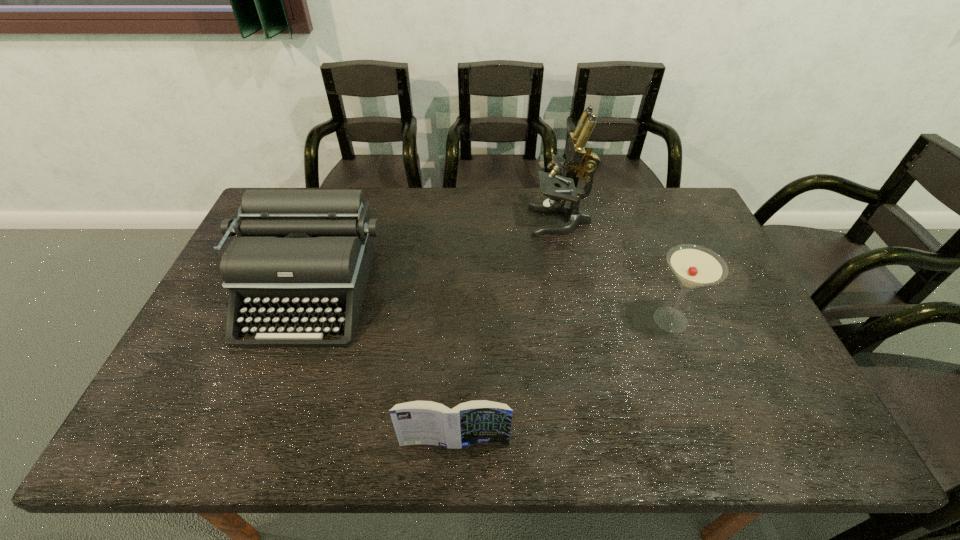
Locate which object is the third closest to the second object from left to right. Please provide its 2D coordinates. Your answer should be formatted as a tuple, i.e. [(x, y)], where the tuple contains the x and y coordinates of a point satisfying the conditions above.

[(579, 153)]

Find the location of a particular element. The width and height of the screenshot is (960, 540). free location that satisfies the following two spatial constraints: 1. at the eyepieces of the tallest object; 2. on the front cover of the nearest object is located at coordinates (605, 443).

This screenshot has width=960, height=540. I want to click on vacant region that satisfies the following two spatial constraints: 1. at the eyepieces of the tallest object; 2. on the front cover of the nearest object, so (x=605, y=443).

Identify the location of free space that satisfies the following two spatial constraints: 1. on the typing side of the martini; 2. on the left side of the typewriter. (299, 320).

This screenshot has width=960, height=540. In order to click on vacant point that satisfies the following two spatial constraints: 1. at the eyepieces of the microscope; 2. on the front cover of the third object from right to left in this screenshot , I will do `click(605, 443)`.

This screenshot has width=960, height=540. Find the location of `vacant region that satisfies the following two spatial constraints: 1. at the eyepieces of the tallest object; 2. on the front cover of the nearest object`. vacant region that satisfies the following two spatial constraints: 1. at the eyepieces of the tallest object; 2. on the front cover of the nearest object is located at coordinates (605, 443).

This screenshot has height=540, width=960. What are the coordinates of `vacant region that satisfies the following two spatial constraints: 1. at the eyepieces of the second object from right to left; 2. on the typing side of the leftmost object` in the screenshot? It's located at (574, 293).

Find the location of a particular element. free space that satisfies the following two spatial constraints: 1. at the eyepieces of the farthest object; 2. on the front cover of the shortest object is located at coordinates (605, 443).